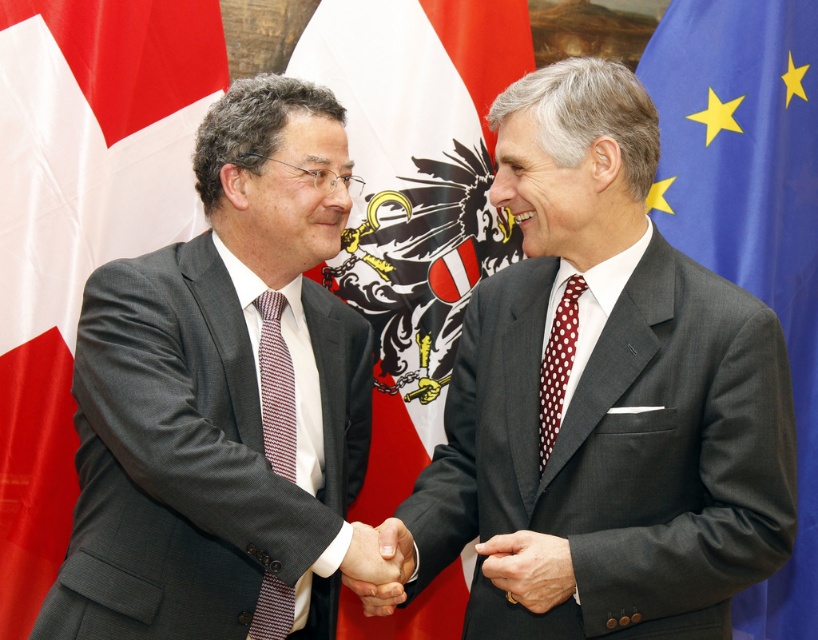
Which is below, matte black suit at left or red dotted tie at center?

Positioned lower is red dotted tie at center.

Who is positioned more to the right, matte black suit at left or red dotted tie at center?

red dotted tie at center

Where is `matte black suit at left`? matte black suit at left is located at coordinates (222, 396).

Where is `matte black suit at left`? matte black suit at left is located at coordinates (222, 396).

From the picture: Is white fabric flag at center smaller than white dotted silk tie at center?

Actually, white fabric flag at center might be larger than white dotted silk tie at center.

Is white fabric flag at center behind white dotted silk tie at center?

Yes, it is.

Which is in front, point (465, 99) or point (560, 371)?

Point (560, 371)

Where is `white fabric flag at center`? This screenshot has height=640, width=818. white fabric flag at center is located at coordinates [416, 198].

Can you confirm if red fabric flag at left is positioned below red dotted tie at center?

No, red fabric flag at left is not below red dotted tie at center.

Which is below, red fabric flag at left or red dotted tie at center?

Positioned lower is red dotted tie at center.

Does point (21, 371) come in front of point (273, 413)?

No, it is not.

Find the location of a particular element. Image resolution: width=818 pixels, height=640 pixels. red fabric flag at left is located at coordinates (79, 225).